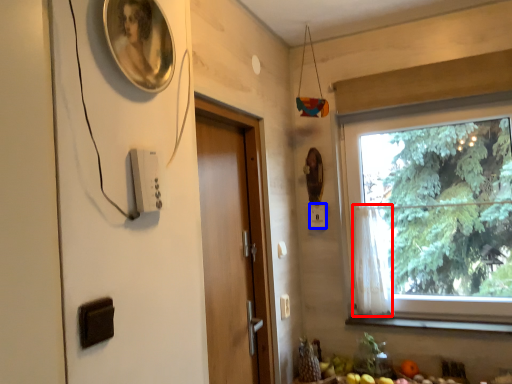
Question: Which object is further to the camera taking this photo, curtain (highlighted by a red box) or light switch (highlighted by a blue box)?

Choices:
 (A) curtain
 (B) light switch

Answer: (B)